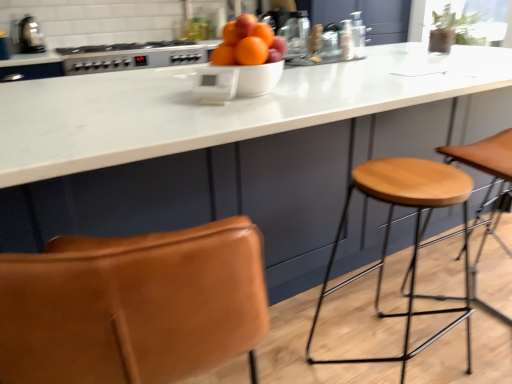
Question: Can you confirm if satin silver gas stove at upper center is thinner than light brown wood stool at right?

Choices:
 (A) no
 (B) yes

Answer: (A)

Question: Are satin silver gas stove at upper center and light brown wood stool at right making contact?

Choices:
 (A) no
 (B) yes

Answer: (A)

Question: Can you confirm if satin silver gas stove at upper center is bigger than light brown wood stool at right?

Choices:
 (A) no
 (B) yes

Answer: (A)

Question: From a real-world perspective, is satin silver gas stove at upper center over light brown wood stool at right?

Choices:
 (A) yes
 (B) no

Answer: (A)

Question: From a real-world perspective, is satin silver gas stove at upper center physically below light brown wood stool at right?

Choices:
 (A) no
 (B) yes

Answer: (A)

Question: Does point tap(381, 256) appear closer or farther from the camera than point tap(507, 130)?

Choices:
 (A) farther
 (B) closer

Answer: (A)

Question: Considering the relative positions of wooden seat at right and light brown wood stool at right in the image provided, is wooden seat at right to the left or to the right of light brown wood stool at right?

Choices:
 (A) left
 (B) right

Answer: (A)

Question: Looking at their shapes, would you say wooden seat at right is wider or thinner than light brown wood stool at right?

Choices:
 (A) wide
 (B) thin

Answer: (B)

Question: Is wooden seat at right bigger or smaller than light brown wood stool at right?

Choices:
 (A) small
 (B) big

Answer: (A)

Question: From the image's perspective, relative to satin silver gas stove at upper center, is white plastic thermostat at center, the first appliance viewed from the front, above or below?

Choices:
 (A) below
 (B) above

Answer: (A)

Question: Considering the positions of white plastic thermostat at center, the first appliance viewed from the front, and satin silver gas stove at upper center in the image, is white plastic thermostat at center, the first appliance viewed from the front, wider or thinner than satin silver gas stove at upper center?

Choices:
 (A) thin
 (B) wide

Answer: (A)

Question: Is white plastic thermostat at center, the 1th appliance in the bottom-to-top sequence, situated inside satin silver gas stove at upper center or outside?

Choices:
 (A) outside
 (B) inside

Answer: (A)

Question: Considering the positions of white plastic thermostat at center, the 1th appliance in the bottom-to-top sequence, and satin silver gas stove at upper center in the image, is white plastic thermostat at center, the 1th appliance in the bottom-to-top sequence, taller or shorter than satin silver gas stove at upper center?

Choices:
 (A) short
 (B) tall

Answer: (A)

Question: Is white glossy bowl at center bigger or smaller than white plastic thermostat at center, the 1th appliance in the bottom-to-top sequence?

Choices:
 (A) big
 (B) small

Answer: (A)

Question: Relative to white plastic thermostat at center, placed as the second appliance when sorted from top to bottom, is white glossy bowl at center in front or behind?

Choices:
 (A) behind
 (B) front

Answer: (A)